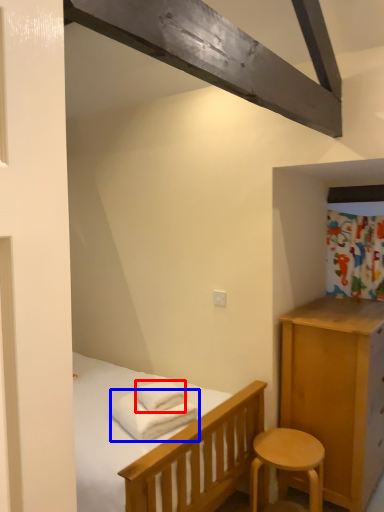
Question: Among these objects, which one is nearest to the camera, bath towel (highlighted by a red box) or bath towel (highlighted by a blue box)?

Choices:
 (A) bath towel
 (B) bath towel

Answer: (B)